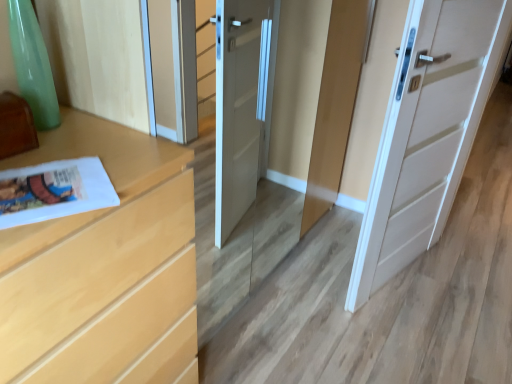
This screenshot has width=512, height=384. What are the coordinates of `vacant location below white glossy magazine at lower left (from a real-world perspective)` in the screenshot? It's located at pyautogui.click(x=42, y=192).